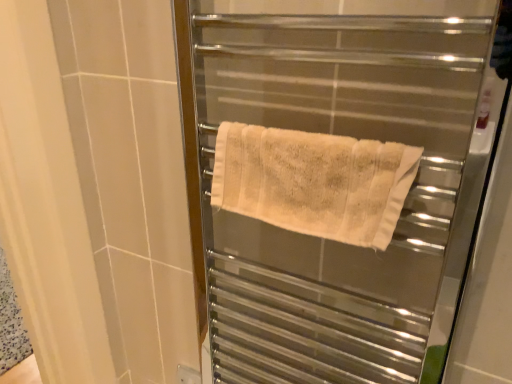
Question: Is beige cotton towel at center to the left or to the right of white textured towel at center in the image?

Choices:
 (A) left
 (B) right

Answer: (A)

Question: In terms of size, does beige cotton towel at center appear bigger or smaller than white textured towel at center?

Choices:
 (A) big
 (B) small

Answer: (B)

Question: Considering the positions of beige cotton towel at center and white textured towel at center in the image, is beige cotton towel at center taller or shorter than white textured towel at center?

Choices:
 (A) short
 (B) tall

Answer: (A)

Question: Considering the positions of white textured towel at center and beige cotton towel at center in the image, is white textured towel at center wider or thinner than beige cotton towel at center?

Choices:
 (A) thin
 (B) wide

Answer: (B)

Question: From a real-world perspective, relative to beige cotton towel at center, is white textured towel at center vertically above or below?

Choices:
 (A) above
 (B) below

Answer: (B)

Question: Considering the positions of white textured towel at center and beige cotton towel at center in the image, is white textured towel at center taller or shorter than beige cotton towel at center?

Choices:
 (A) tall
 (B) short

Answer: (A)

Question: From the image's perspective, is white textured towel at center positioned above or below beige cotton towel at center?

Choices:
 (A) below
 (B) above

Answer: (A)